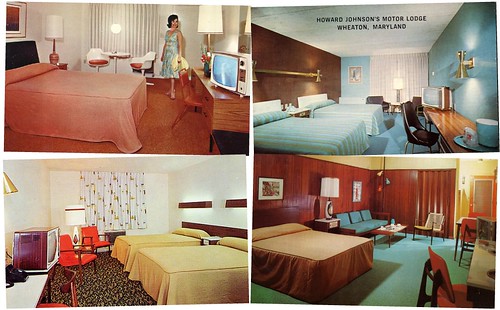
Where is `pillows`? This screenshot has width=500, height=310. pillows is located at coordinates (185, 229), (236, 241), (286, 226), (278, 113), (321, 99), (37, 73).